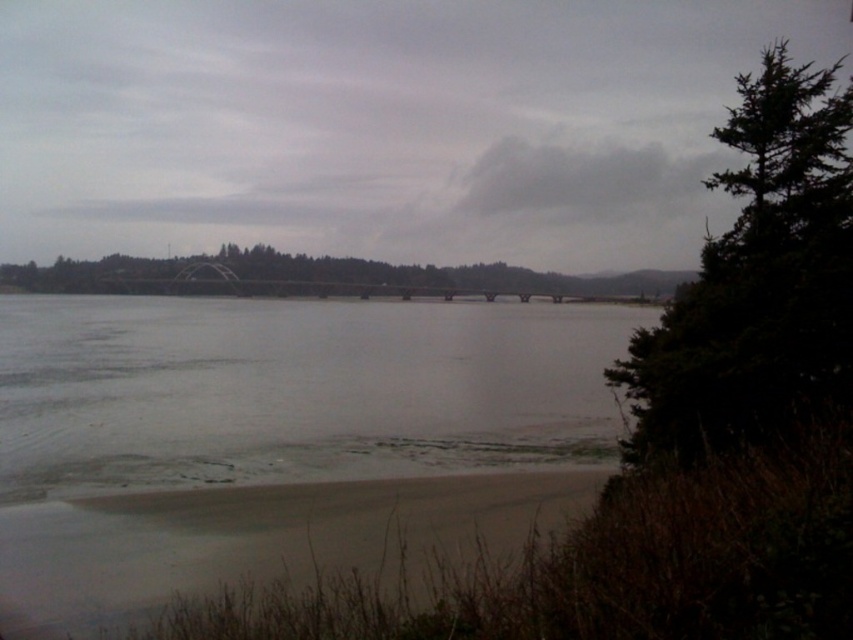
You are standing at the point with coordinates point (13, 269) and want to see if you can see the point (432, 323). Since you are at a lower elevation, would the bridge block your view?

Point (432, 323) is in front of point (13, 269), so yes, the bridge would block your view of point (432, 323) because it is closer to you and situated between you and the point.

Consider the image. You are a drone operator trying to capture a photo of the clear water at center. The drone is currently at coordinates point A. To ensure the water is in the center of your shot, where should you adjust the drone to? Use the coordinates provided in the description to determine the correct position.

The clear water at center is located at coordinates point A, so the drone should be positioned at point A to ensure the water is centered in the shot.

In the scene shown: You are standing at the point with coordinates point (x=18, y=268) and want to reach the point with coordinates point (x=726, y=246). Which direction should you move to get closer to your destination?

You should move forward because point (x=726, y=246) is in front of point (x=18, y=268).